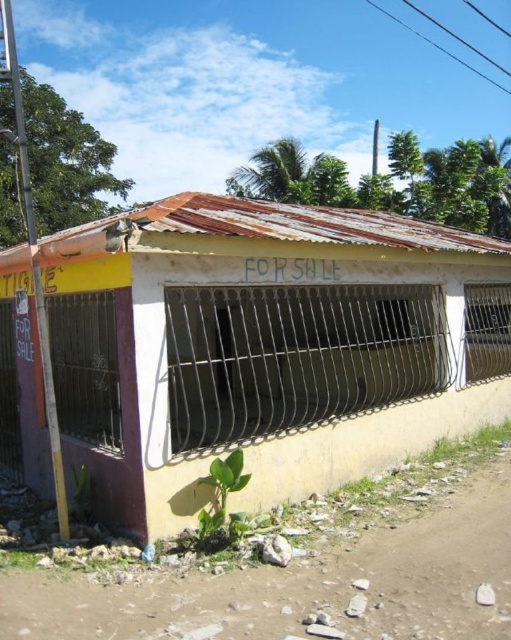
You are a delivery driver who needs to park your truck, which is 3 meters wide, near the yellow matte building at center. The brown dirt track at lower left is the only available parking spot. Can your truck fit there?

The yellow matte building at center is wider than the brown dirt track at lower left, so the truck cannot fit in the parking spot because the track is narrower than the truck.

You are a delivery driver trying to park your truck near the yellow matte building at center. The brown dirt track at lower left is the only available parking spot. Considering the size of the building, do you think the dirt track can accommodate your truck?

The yellow matte building at center is bigger than the brown dirt track at lower left, so the dirt track may not be large enough to accommodate the truck. It is recommended to look for a larger parking area.

You are a delivery driver approaching the yellow matte building at center. You notice a brown dirt track at lower left. From your perspective, is the dirt track in front of or behind the building?

The brown dirt track at lower left is behind yellow matte building at center, so from your perspective, the dirt track is behind the building.